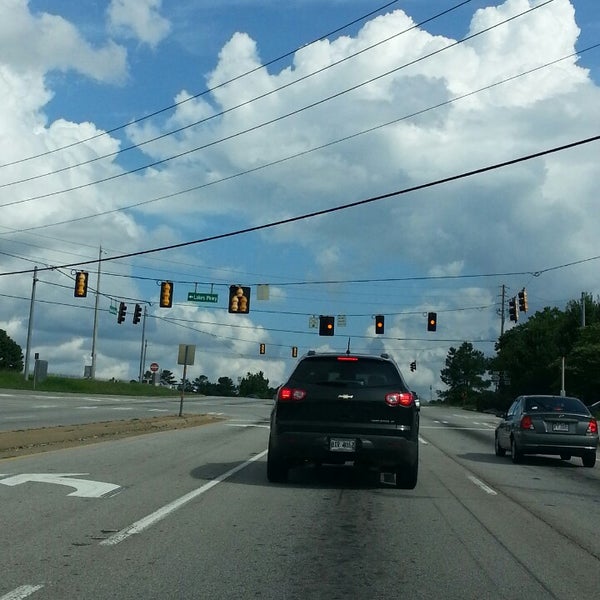
Find the location of a particular element. This screenshot has width=600, height=600. yellow light is located at coordinates (430, 324).